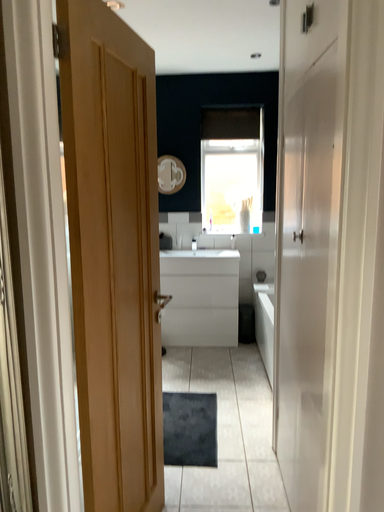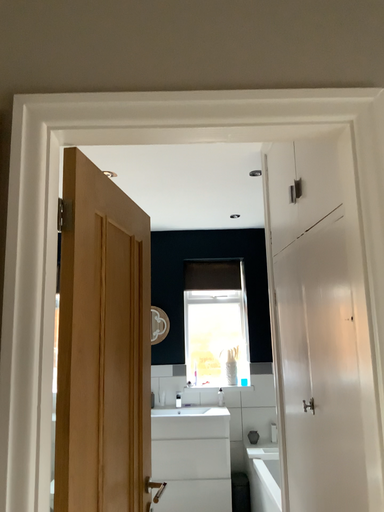
Question: How did the camera likely rotate when shooting the video?

Choices:
 (A) rotated downward
 (B) rotated upward

Answer: (B)